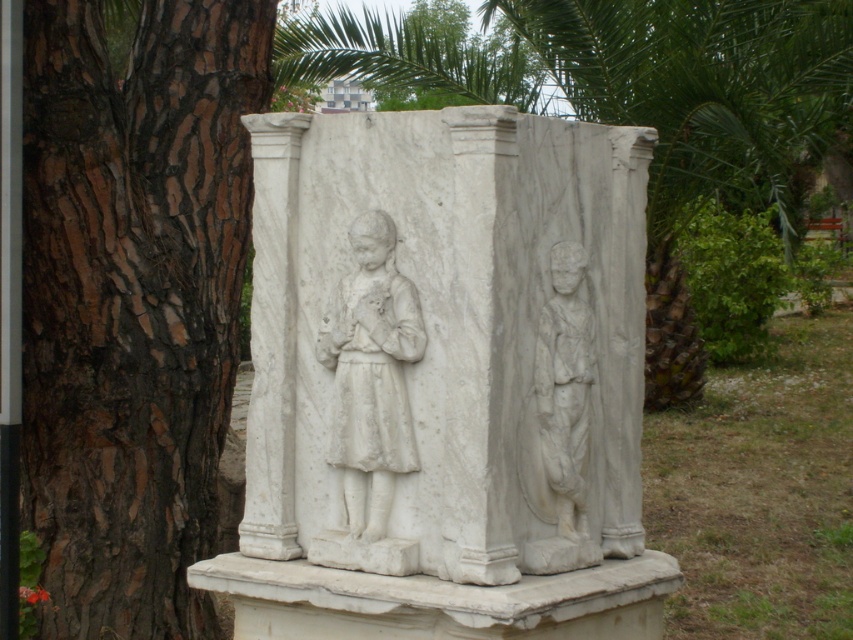
Question: Observing the image, what is the correct spatial positioning of brown rough bark tree at left in reference to white marble statue at right?

Choices:
 (A) below
 (B) above

Answer: (B)

Question: Which object is the closest to the brown rough bark tree at left?

Choices:
 (A) white marble statue at center
 (B) white marble statue at right

Answer: (A)

Question: Which of the following is the closest to the observer?

Choices:
 (A) [x=62, y=202]
 (B) [x=584, y=353]
 (C) [x=372, y=496]

Answer: (C)

Question: Does brown rough bark tree at left appear on the left side of white marble statue at center?

Choices:
 (A) yes
 (B) no

Answer: (A)

Question: Is brown rough bark tree at left positioned at the back of white marble statue at center?

Choices:
 (A) yes
 (B) no

Answer: (A)

Question: Which of these objects is positioned farthest from the white marble statue at right?

Choices:
 (A) brown rough bark tree at left
 (B) white marble statue at center

Answer: (A)